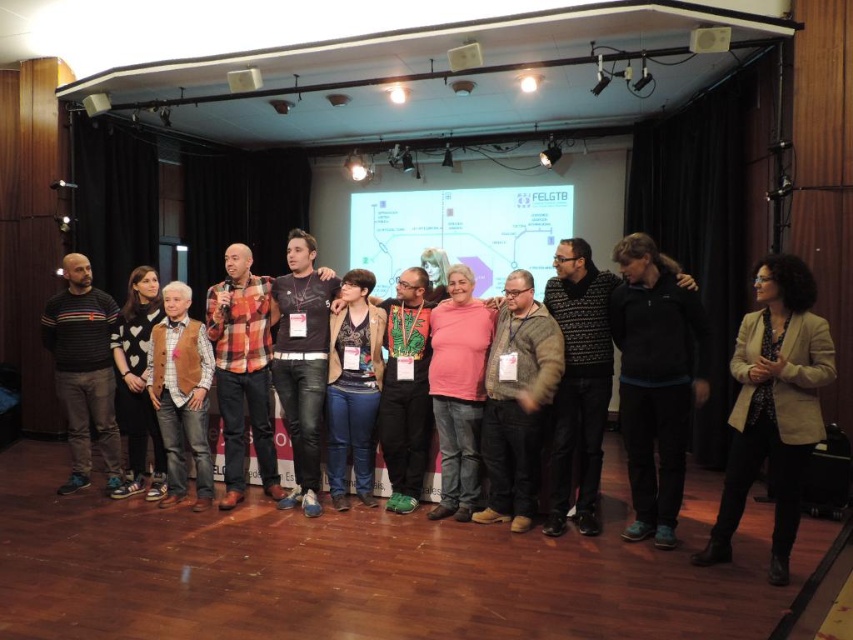
You are an event planner setting up a new projector. The projector needs to be placed so that its beam can reach the white matte projection screen at center without obstruction. Given that the projector has a standard throw distance of 3 meters, can you confirm if the current setup allows the projector to project onto the screen?

The white matte projection screen at center is located at point [459,232], but without knowing the exact dimensions of the stage or the placement of the projector, it is impossible to determine if the 3 meter throw distance will reach the screen. Additional spatial information is needed.

What is the object at the point with coordinates (517, 401)?

The object at the point with coordinates (517, 401) is the knitted sweater at center.

You are a photographer standing in front of the stage. You need to capture a photo where both the black fleece jacket at center and the pink matte sweater at center are clearly visible. Given their sizes, which object should you focus on to ensure both are in frame?

The black fleece jacket at center is much taller than the pink matte sweater at center, so focusing on the taller black fleece jacket at center will ensure both are visible in the photo.